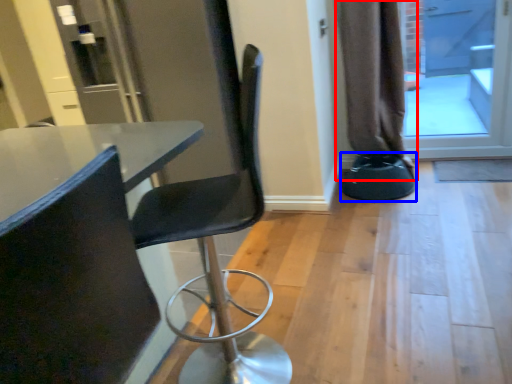
Question: Which object appears closest to the camera in this image, curtain (highlighted by a red box) or bar stool (highlighted by a blue box)?

Choices:
 (A) curtain
 (B) bar stool

Answer: (A)